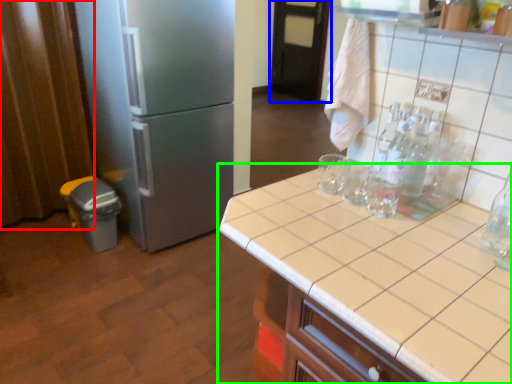
Question: Which object is positioned closest to curtain (highlighted by a red box)? Select from door (highlighted by a blue box) and countertop (highlighted by a green box).

Choices:
 (A) door
 (B) countertop

Answer: (B)